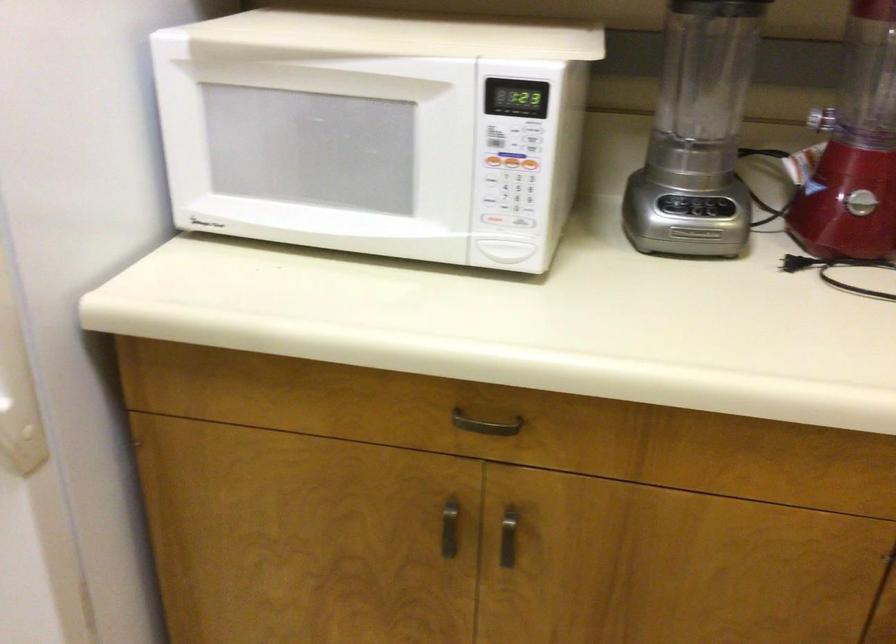
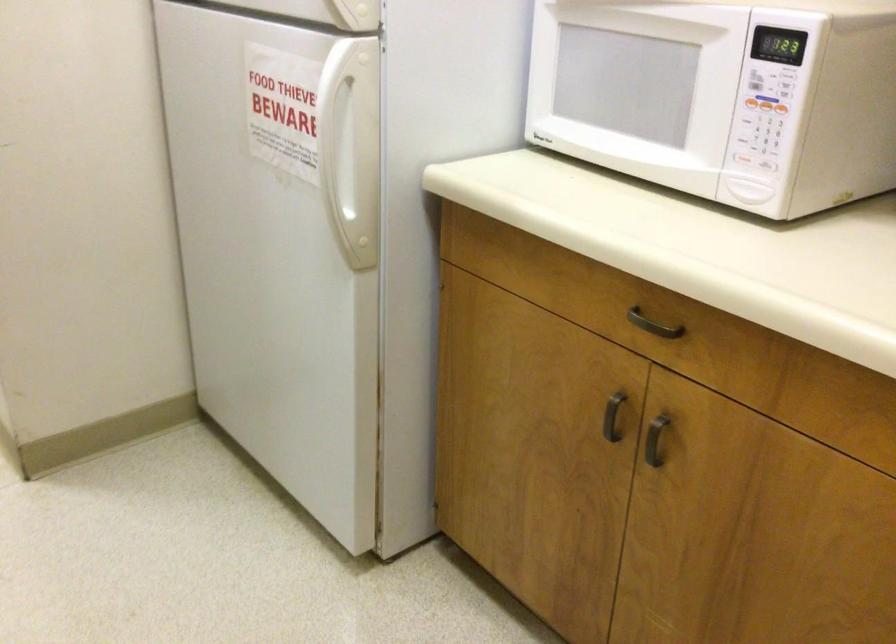
Locate, in the second image, the point that corresponds to point 497,162 in the first image.

(752, 102)